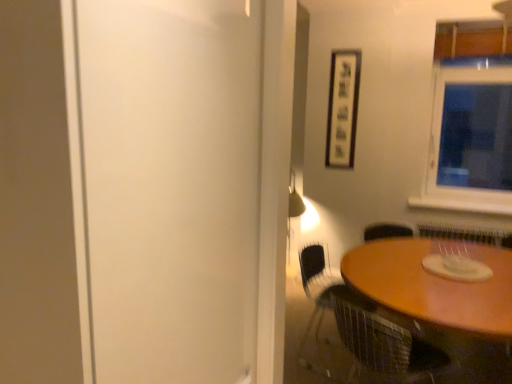
The image size is (512, 384). What do you see at coordinates (441, 293) in the screenshot?
I see `wooden table at lower right` at bounding box center [441, 293].

Image resolution: width=512 pixels, height=384 pixels. In order to click on transparent glass window at upper right in this screenshot , I will do `click(469, 143)`.

What do you see at coordinates (342, 108) in the screenshot? This screenshot has height=384, width=512. I see `wooden framed artwork at upper right` at bounding box center [342, 108].

What do you see at coordinates (382, 341) in the screenshot? I see `metal mesh chair at lower right` at bounding box center [382, 341].

Locate an element on the screen. metal mesh chair at lower right is located at coordinates (382, 341).

The image size is (512, 384). Identify the location of wooden table at lower right. (441, 293).

Between point (106, 200) and point (507, 144), which one is positioned in front?

The point (106, 200) is more forward.

Does white matte screen door at left have a lesser width compared to transparent glass window at upper right?

In fact, white matte screen door at left might be wider than transparent glass window at upper right.

From the image's perspective, is white matte screen door at left beneath transparent glass window at upper right?

Correct, white matte screen door at left appears lower than transparent glass window at upper right in the image.

From a real-world perspective, who is located lower, white matte screen door at left or metal mesh chair at lower right?

metal mesh chair at lower right.

Based on their positions, is white matte screen door at left located to the left or right of metal mesh chair at lower right?

In the image, white matte screen door at left appears on the left side of metal mesh chair at lower right.

Considering the relative sizes of white matte screen door at left and metal mesh chair at lower right in the image provided, is white matte screen door at left bigger than metal mesh chair at lower right?

Yes, white matte screen door at left is bigger than metal mesh chair at lower right.

Which is more distant, [127,71] or [416,336]?

The point [416,336] is more distant.

Considering the sizes of objects transparent glass window at upper right and white matte screen door at left in the image provided, who is shorter, transparent glass window at upper right or white matte screen door at left?

With less height is transparent glass window at upper right.

Would you consider transparent glass window at upper right to be distant from white matte screen door at left?

Yes, transparent glass window at upper right and white matte screen door at left are quite far apart.

Is white matte screen door at left inside transparent glass window at upper right?

That's incorrect, white matte screen door at left is not inside transparent glass window at upper right.

Does point (486, 201) appear closer or farther from the camera than point (220, 366)?

Clearly, point (486, 201) is more distant from the camera than point (220, 366).

How far apart are wooden table at lower right and transparent glass window at upper right?

wooden table at lower right and transparent glass window at upper right are 1.51 meters apart.

This screenshot has height=384, width=512. Identify the location of table in front of the transparent glass window at upper right. (441, 293).

Consider the image. Is wooden table at lower right not near transparent glass window at upper right?

wooden table at lower right is far away from transparent glass window at upper right.

Looking at their sizes, would you say wooden table at lower right is wider or thinner than transparent glass window at upper right?

Considering their sizes, wooden table at lower right looks broader than transparent glass window at upper right.

Is metal mesh chair at lower right far away from wooden table at lower right?

That's not correct — metal mesh chair at lower right is a little close to wooden table at lower right.

Considering the sizes of metal mesh chair at lower right and wooden table at lower right in the image, is metal mesh chair at lower right bigger or smaller than wooden table at lower right?

metal mesh chair at lower right is smaller than wooden table at lower right.

Who is shorter, metal mesh chair at lower right or wooden table at lower right?

Standing shorter between the two is metal mesh chair at lower right.

Based on their positions, is metal mesh chair at lower right located to the left or right of wooden table at lower right?

metal mesh chair at lower right is positioned on wooden table at lower right's left side.

Based on the photo, does wooden table at lower right come behind wooden framed artwork at upper right?

No, wooden table at lower right is closer to the viewer.

Based on the photo, from the image's perspective, does wooden table at lower right appear higher than wooden framed artwork at upper right?

Actually, wooden table at lower right appears below wooden framed artwork at upper right in the image.

Between wooden table at lower right and wooden framed artwork at upper right, which one has larger size?

wooden table at lower right.

What's the angular difference between wooden framed artwork at upper right and wooden table at lower right's facing directions?

There is a 85.8-degree angle between the facing directions of wooden framed artwork at upper right and wooden table at lower right.

Is wooden framed artwork at upper right in front of or behind wooden table at lower right in the image?

wooden framed artwork at upper right is positioned farther from the viewer than wooden table at lower right.

Could wooden table at lower right be considered to be inside wooden framed artwork at upper right?

No, wooden table at lower right is not a part of wooden framed artwork at upper right.

At what (x,y) coordinates should I click in order to perform the action: click on screen door that appears on the left of transparent glass window at upper right. Please return your answer as a coordinate pair (x, y). The width and height of the screenshot is (512, 384). Looking at the image, I should click on (170, 186).

The height and width of the screenshot is (384, 512). I want to click on chair lying on the right of white matte screen door at left, so click(382, 341).

Considering their positions, is white matte screen door at left positioned further to metal mesh chair at lower right than transparent glass window at upper right?

Based on the image, transparent glass window at upper right appears to be further to metal mesh chair at lower right.

Which object lies nearer to the anchor point metal mesh chair at lower right, wooden framed artwork at upper right or wooden table at lower right?

Based on the image, wooden table at lower right appears to be nearer to metal mesh chair at lower right.

Considering their positions, is wooden table at lower right positioned closer to metal mesh chair at lower right than wooden framed artwork at upper right?

Based on the image, wooden table at lower right appears to be nearer to metal mesh chair at lower right.

Looking at the image, which one is located further to wooden framed artwork at upper right, transparent glass window at upper right or wooden table at lower right?

The object further to wooden framed artwork at upper right is wooden table at lower right.

Considering their positions, is wooden table at lower right positioned further to white matte screen door at left than transparent glass window at upper right?

transparent glass window at upper right is further to white matte screen door at left.

Consider the image. Considering their positions, is wooden table at lower right positioned further to wooden framed artwork at upper right than transparent glass window at upper right?

Among the two, wooden table at lower right is located further to wooden framed artwork at upper right.

Estimate the real-world distances between objects in this image. Which object is closer to white matte screen door at left, wooden framed artwork at upper right or wooden table at lower right?

wooden table at lower right is positioned closer to the anchor white matte screen door at left.

Considering their positions, is wooden framed artwork at upper right positioned further to metal mesh chair at lower right than white matte screen door at left?

The object further to metal mesh chair at lower right is wooden framed artwork at upper right.

I want to click on chair situated between white matte screen door at left and wooden table at lower right from left to right, so click(x=382, y=341).

Where is `chair positioned between white matte screen door at left and transparent glass window at upper right from near to far`? This screenshot has height=384, width=512. chair positioned between white matte screen door at left and transparent glass window at upper right from near to far is located at coordinates (382, 341).

Find the location of a particular element. This screenshot has width=512, height=384. chair between white matte screen door at left and wooden framed artwork at upper right from front to back is located at coordinates (382, 341).

Identify the location of table located between white matte screen door at left and transparent glass window at upper right in the depth direction. (441, 293).